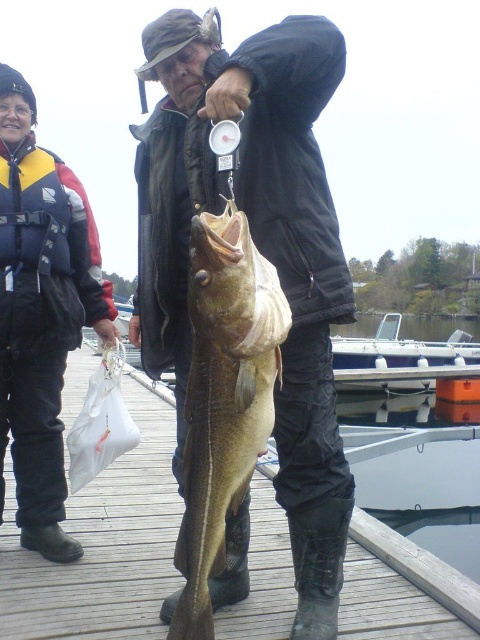
Between point (264, 604) and point (41, 157), which one is positioned in front?

Point (264, 604) is more forward.

Does wooden dock at center appear on the left side of black nylon jacket at left?

Incorrect, wooden dock at center is not on the left side of black nylon jacket at left.

Does point (47, 588) come in front of point (29, 259)?

Yes.

Locate an element on the screen. This screenshot has width=480, height=640. wooden dock at center is located at coordinates (103, 545).

Is black nylon jacket at left below greenish-yellow flesh at center?

No.

Is black nylon jacket at left above greenish-yellow flesh at center?

Correct, black nylon jacket at left is located above greenish-yellow flesh at center.

What do you see at coordinates (40, 314) in the screenshot? I see `black nylon jacket at left` at bounding box center [40, 314].

Where is `black nylon jacket at left`? Image resolution: width=480 pixels, height=640 pixels. black nylon jacket at left is located at coordinates (40, 314).

Which is below, matte black jacket at center or black nylon jacket at left?

matte black jacket at center

Can you confirm if matte black jacket at center is positioned to the right of black nylon jacket at left?

Indeed, matte black jacket at center is positioned on the right side of black nylon jacket at left.

What are the coordinates of `matte black jacket at center` in the screenshot? It's located at (257, 248).

The height and width of the screenshot is (640, 480). I want to click on matte black jacket at center, so click(257, 248).